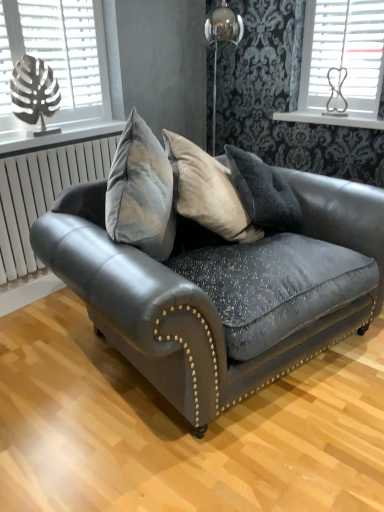
Question: Is metallic leaf at left, the second window positioned from the right, shorter than white wooden shelf at upper right?

Choices:
 (A) yes
 (B) no

Answer: (B)

Question: Is metallic leaf at left, the second window positioned from the right, outside white wooden shelf at upper right?

Choices:
 (A) yes
 (B) no

Answer: (A)

Question: Considering the relative positions of metallic leaf at left, the second window positioned from the right, and white wooden shelf at upper right in the image provided, is metallic leaf at left, the second window positioned from the right, behind white wooden shelf at upper right?

Choices:
 (A) no
 (B) yes

Answer: (A)

Question: Considering the relative positions of metallic leaf at left, the second window positioned from the right, and white wooden shelf at upper right in the image provided, is metallic leaf at left, the second window positioned from the right, to the right of white wooden shelf at upper right from the viewer's perspective?

Choices:
 (A) no
 (B) yes

Answer: (A)

Question: From a real-world perspective, is metallic leaf at left, the 1th window when ordered from left to right, over white wooden shelf at upper right?

Choices:
 (A) no
 (B) yes

Answer: (B)

Question: Does point (380, 94) appear closer or farther from the camera than point (19, 46)?

Choices:
 (A) closer
 (B) farther

Answer: (B)

Question: Considering the relative positions of white plastic blinds at upper right, the 2th window positioned from the left, and metallic leaf at left, the 1th window when ordered from left to right, in the image provided, is white plastic blinds at upper right, the 2th window positioned from the left, to the left or to the right of metallic leaf at left, the 1th window when ordered from left to right,?

Choices:
 (A) right
 (B) left

Answer: (A)

Question: In terms of size, does white plastic blinds at upper right, the 2th window positioned from the left, appear bigger or smaller than metallic leaf at left, the 1th window when ordered from left to right?

Choices:
 (A) big
 (B) small

Answer: (B)

Question: In terms of height, does white plastic blinds at upper right, the 2th window positioned from the left, look taller or shorter compared to metallic leaf at left, the second window positioned from the right?

Choices:
 (A) short
 (B) tall

Answer: (A)

Question: Based on their sizes in the image, would you say white wooden shelf at upper right is bigger or smaller than white metallic radiator at left?

Choices:
 (A) small
 (B) big

Answer: (A)

Question: Is white wooden shelf at upper right wider or thinner than white metallic radiator at left?

Choices:
 (A) wide
 (B) thin

Answer: (A)

Question: Do you think white wooden shelf at upper right is within white metallic radiator at left, or outside of it?

Choices:
 (A) outside
 (B) inside

Answer: (A)

Question: From the image's perspective, is white wooden shelf at upper right located above or below white metallic radiator at left?

Choices:
 (A) above
 (B) below

Answer: (A)

Question: From the image's perspective, is velvet dark gray couch at center above or below white metallic radiator at left?

Choices:
 (A) below
 (B) above

Answer: (A)

Question: Considering the positions of velvet dark gray couch at center and white metallic radiator at left in the image, is velvet dark gray couch at center wider or thinner than white metallic radiator at left?

Choices:
 (A) wide
 (B) thin

Answer: (A)